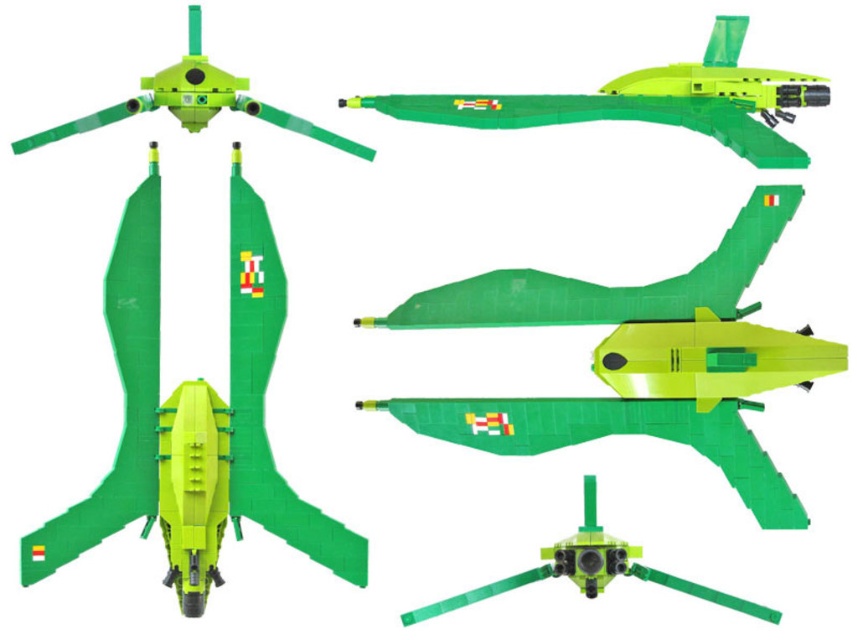
Can you confirm if matte green plastic helicopter at bottom is taller than matte green drone at center?

Indeed, matte green plastic helicopter at bottom has a greater height compared to matte green drone at center.

Image resolution: width=858 pixels, height=640 pixels. What do you see at coordinates (192, 419) in the screenshot?
I see `matte green plastic helicopter at bottom` at bounding box center [192, 419].

You are a GUI agent. You are given a task and a screenshot of the screen. Output one action in this format:
    pyautogui.click(x=<x>, y=<y>)
    Task: Click on the matte green plastic helicopter at bottom
    The width and height of the screenshot is (858, 640).
    Given the screenshot: What is the action you would take?
    pyautogui.click(x=192, y=419)

Who is taller, matte plastic drone at upper left or matte green drone at center?

With more height is matte plastic drone at upper left.

Does matte plastic drone at upper left appear under matte green drone at center?

No, matte plastic drone at upper left is not below matte green drone at center.

Is point (190, 116) more distant than point (707, 589)?

Yes, it is behind point (707, 589).

The image size is (858, 640). Identify the location of matte plastic drone at upper left. (192, 100).

Consider the image. Who is more distant from viewer, [298,497] or [183,100]?

Point [183,100]

Does matte green plastic helicopter at bottom appear on the left side of matte plastic drone at upper left?

No, matte green plastic helicopter at bottom is not to the left of matte plastic drone at upper left.

Which is behind, point (275, 285) or point (112, 120)?

Positioned behind is point (275, 285).

Identify the location of matte green plastic helicopter at bottom. (192, 419).